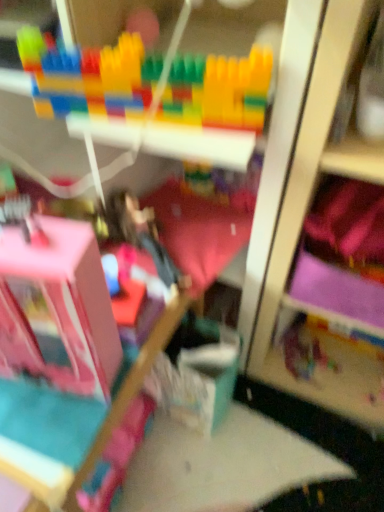
Question: Should I look upward or downward to see multicolored plastic blocks at upper center, arranged as the 2th toy when viewed from the left?

Choices:
 (A) down
 (B) up

Answer: (B)

Question: Would you say pink fabric bed frame at lower left is outside pink fabric bedding at center?

Choices:
 (A) yes
 (B) no

Answer: (A)

Question: Considering the relative sizes of pink fabric bed frame at lower left and pink fabric bedding at center in the image provided, is pink fabric bed frame at lower left wider than pink fabric bedding at center?

Choices:
 (A) yes
 (B) no

Answer: (A)

Question: Can you confirm if pink fabric bed frame at lower left is positioned to the right of pink fabric bedding at center?

Choices:
 (A) yes
 (B) no

Answer: (B)

Question: Is pink fabric bed frame at lower left positioned behind pink fabric bedding at center?

Choices:
 (A) no
 (B) yes

Answer: (A)

Question: Are pink fabric bed frame at lower left and pink fabric bedding at center far apart?

Choices:
 (A) yes
 (B) no

Answer: (B)

Question: Can you confirm if pink fabric bed frame at lower left is smaller than pink fabric bedding at center?

Choices:
 (A) no
 (B) yes

Answer: (A)

Question: From a real-world perspective, does multicolored plastic blocks at upper center, positioned as the 2th toy in front-to-back order, sit lower than translucent plastic toy at center, the 3th toy when ordered from front to back?

Choices:
 (A) yes
 (B) no

Answer: (B)

Question: Does multicolored plastic blocks at upper center, arranged as the 2th toy when viewed from the left, contain translucent plastic toy at center, acting as the 3th toy starting from the top?

Choices:
 (A) yes
 (B) no

Answer: (B)

Question: Does multicolored plastic blocks at upper center, which is the second toy in right-to-left order, have a smaller size compared to translucent plastic toy at center, the 3th toy when ordered from front to back?

Choices:
 (A) no
 (B) yes

Answer: (A)

Question: Is multicolored plastic blocks at upper center, positioned as the 2th toy in front-to-back order, thinner than translucent plastic toy at center, acting as the 3th toy starting from the top?

Choices:
 (A) yes
 (B) no

Answer: (B)

Question: Is multicolored plastic blocks at upper center, positioned as the 2th toy in front-to-back order, bigger than translucent plastic toy at center, which is the first toy from right to left?

Choices:
 (A) yes
 (B) no

Answer: (A)

Question: Does multicolored plastic blocks at upper center, arranged as the 2th toy when viewed from the left, have a greater height compared to translucent plastic toy at center, which is the first toy from right to left?

Choices:
 (A) yes
 (B) no

Answer: (A)

Question: Is translucent plastic toy at center, the third toy from the left, to the left of pink fabric bedding at center from the viewer's perspective?

Choices:
 (A) yes
 (B) no

Answer: (B)